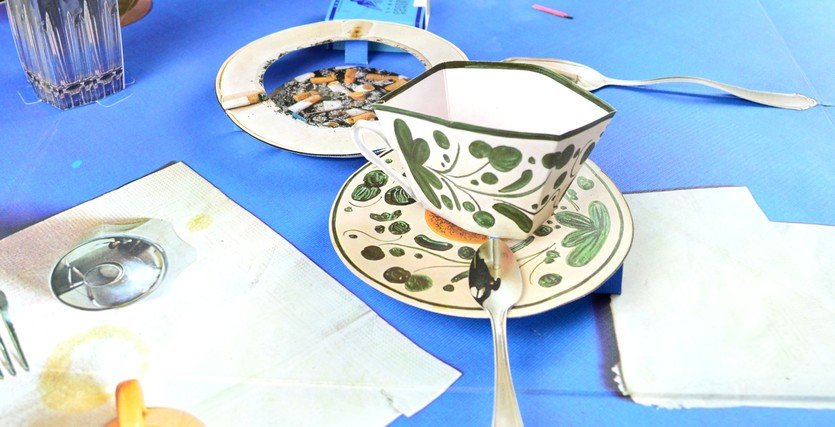
Where is `disgusting ashtray`? disgusting ashtray is located at coordinates (350, 91).